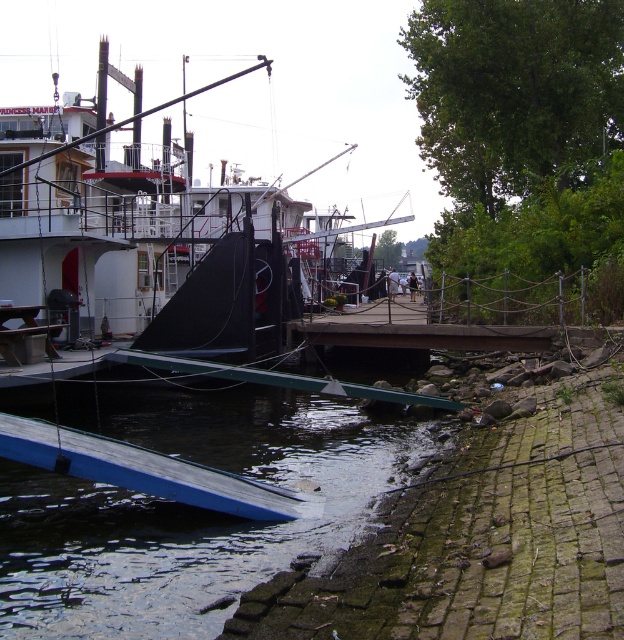
Question: Does blue rubber ramp at lower left have a greater width compared to green mossy bricks at lower right?

Choices:
 (A) yes
 (B) no

Answer: (A)

Question: Which point is farther to the camera?

Choices:
 (A) green mossy bricks at lower right
 (B) white glossy boat at center

Answer: (B)

Question: Is blue rubber ramp at lower left further to the viewer compared to white glossy boat at center?

Choices:
 (A) no
 (B) yes

Answer: (A)

Question: Which object is closer to the camera taking this photo?

Choices:
 (A) green mossy bricks at lower right
 (B) blue rubber ramp at lower left
 (C) white glossy boat at center

Answer: (A)

Question: Can you confirm if green mossy bricks at lower right is bigger than white glossy boat at center?

Choices:
 (A) no
 (B) yes

Answer: (A)

Question: Which object is positioned closest to the white glossy boat at center?

Choices:
 (A) green mossy bricks at lower right
 (B) blue rubber ramp at lower left

Answer: (B)